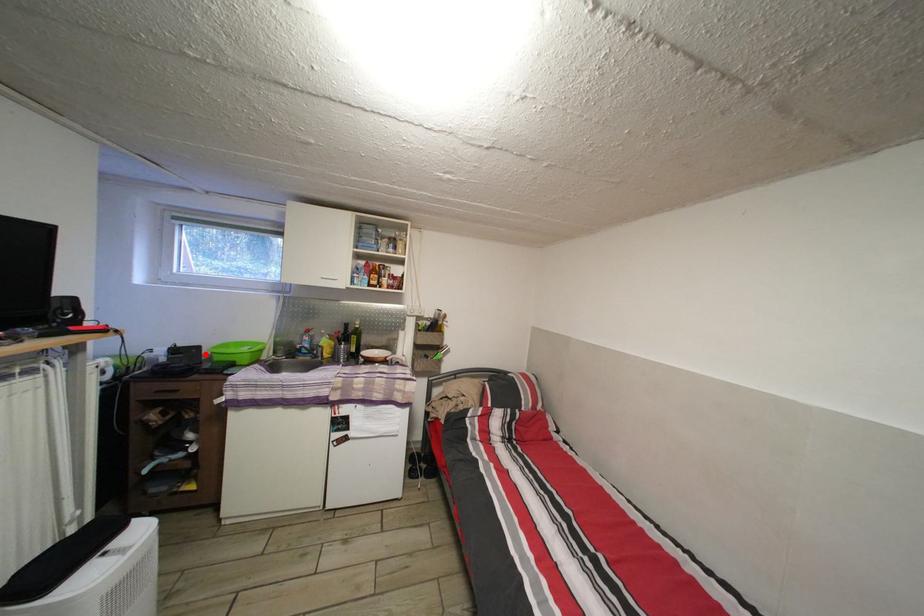
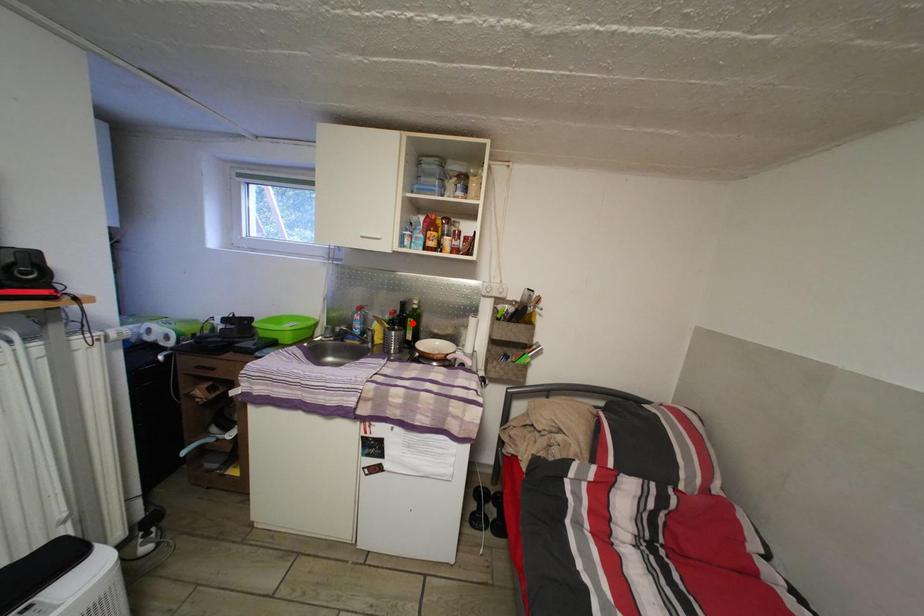
I am providing you with two images of the same scene from different viewpoints. A red point is marked on the first image and another point is marked on the second image. Is the marked point in image1 the same physical position as the marked point in image2?

No